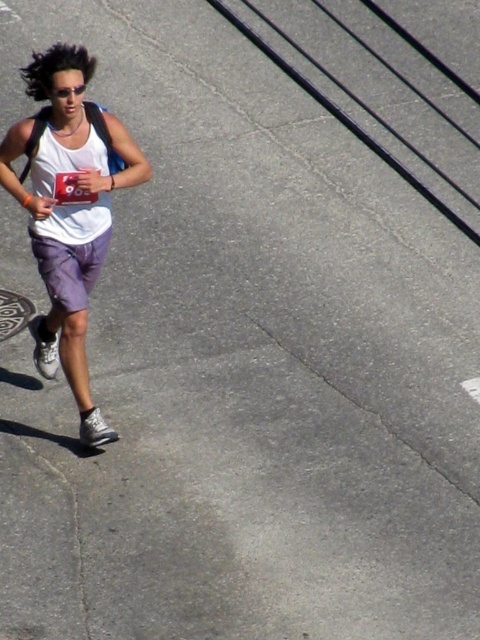
You are a photographer trying to capture the runner wearing a white sleeveless top. The camera is positioned at the point with coordinates point (x=69, y=209). Where should you aim your camera to focus on the runner?

The point (x=69, y=209) corresponds to the white matte tank top at left, so you should aim your camera at the white matte tank top at left to focus on the runner.

You are a photographer trying to capture the runner in the image. You want to ensure that both the white matte tank top at left and the purple cotton shorts at lower left are clearly visible in your shot. Given their sizes, which clothing item should you focus on to ensure it doesn t get obscured by other elements?

The white matte tank top at left is wider than the purple cotton shorts at lower left, so you should focus on keeping the white matte tank top at left in view to prevent it from being obscured by other elements.